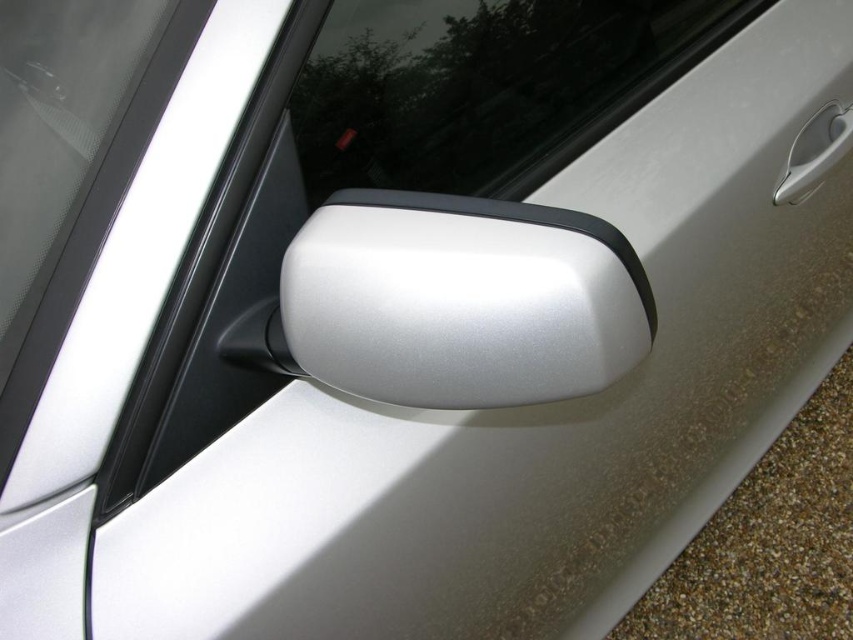
You are a car designer evaluating the proportions of the car in the image. Based on the scene, which object is shorter between the satin silver side mirror at center and the transparent glass at upper center?

The satin silver side mirror at center is shorter than the transparent glass at upper center according to the description.

You are a car designer examining the car model in the image. The satin silver side mirror at center must be positioned precisely for optimal aerodynamics and visibility. Based on its current coordinates, is it placed closer to the front or the rear of the car?

The satin silver side mirror at center is located at point 0.470 on the x and y axes, which means it is positioned closer to the front of the car since the coordinates are less than 0.5, indicating proximity to the front section.

You are a car designer checking the placement of the satin silver side mirror at center and the satin silver door handle at upper right. From the driver seat, which object would appear closer to the driver when looking sideways?

The satin silver side mirror at center is to the left of the satin silver door handle at upper right, so when looking sideways from the driver seat, the satin silver side mirror at center would appear closer to the driver.